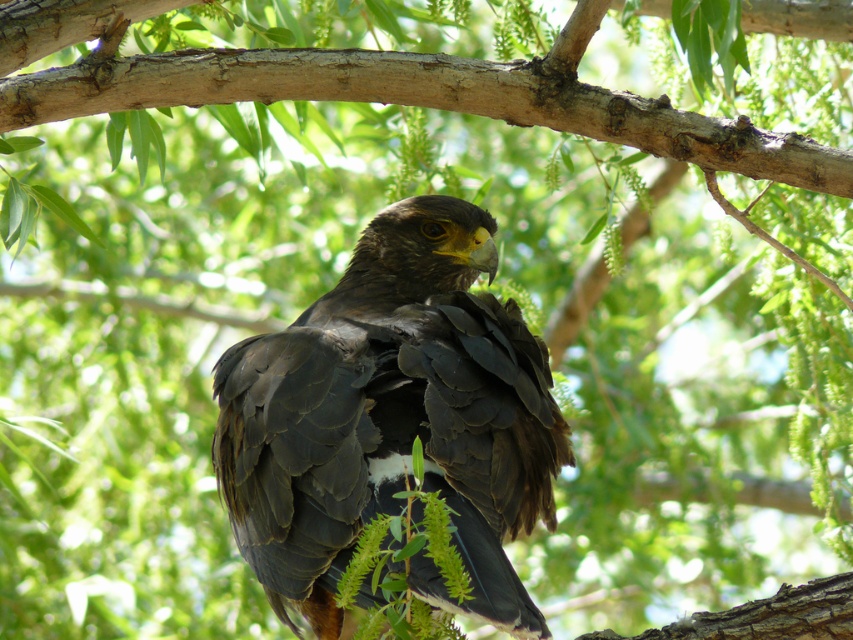
Question: Which of the following is the closest to the observer?

Choices:
 (A) dark brown feathers at center
 (B) smooth brown branch at center

Answer: (A)

Question: Is dark brown feathers at center closer to camera compared to smooth brown branch at center?

Choices:
 (A) no
 (B) yes

Answer: (B)

Question: Is dark brown feathers at center below smooth brown branch at center?

Choices:
 (A) no
 (B) yes

Answer: (B)

Question: Among these points, which one is farthest from the camera?

Choices:
 (A) (277, 548)
 (B) (172, 96)

Answer: (B)

Question: In this image, where is dark brown feathers at center located relative to smooth brown branch at center?

Choices:
 (A) above
 (B) below

Answer: (B)